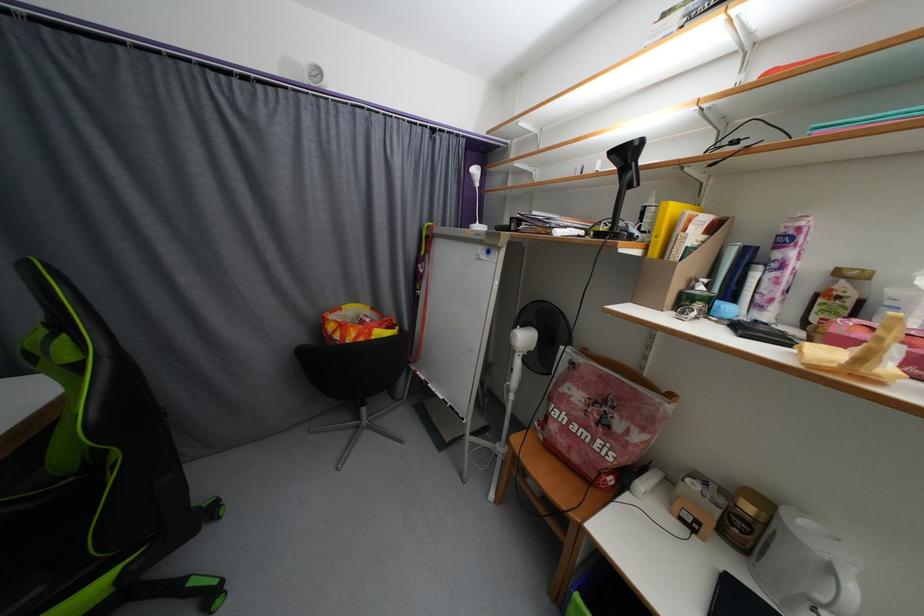
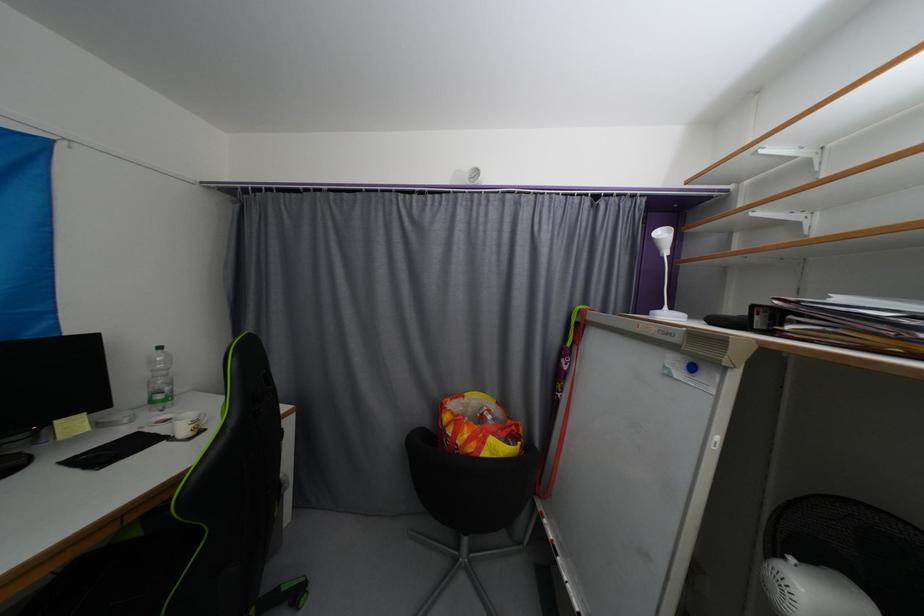
The point at (483, 229) is marked in the first image. Where is the corresponding point in the second image?

(672, 317)